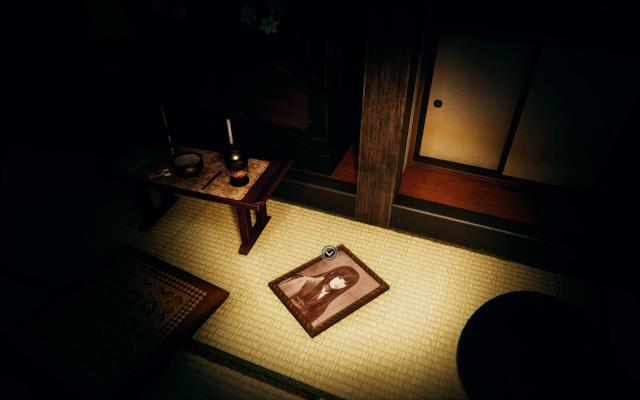
Where is `tan floor`? tan floor is located at coordinates (445, 260).